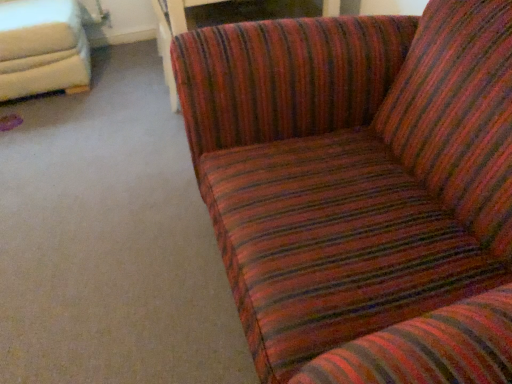
Where is `white leather studio couch at upper left, marked as the second studio couch in a right-to-left arrangement`? Image resolution: width=512 pixels, height=384 pixels. white leather studio couch at upper left, marked as the second studio couch in a right-to-left arrangement is located at coordinates (41, 48).

Where is `wooden table at center`? wooden table at center is located at coordinates (223, 21).

Find the location of a particular element. striped fabric couch at upper right, the second studio couch positioned from the left is located at coordinates (361, 189).

Which object is positioned more to the left, striped fabric couch at upper right, the second studio couch positioned from the left, or wooden table at center?

→ striped fabric couch at upper right, the second studio couch positioned from the left.

I want to click on table above the striped fabric couch at upper right, marked as the first studio couch in a right-to-left arrangement (from a real-world perspective), so click(223, 21).

Relative to wooden table at center, is striped fabric couch at upper right, the second studio couch positioned from the left, in front or behind?

Visually, striped fabric couch at upper right, the second studio couch positioned from the left, is located in front of wooden table at center.

From the image's perspective, who appears lower, striped fabric couch at upper right, the second studio couch positioned from the left, or wooden table at center?

striped fabric couch at upper right, the second studio couch positioned from the left, from the image's perspective.

Looking at this image, what's the angular difference between wooden table at center and striped fabric couch at upper right, the second studio couch positioned from the left,'s facing directions?

wooden table at center and striped fabric couch at upper right, the second studio couch positioned from the left, are facing 90.4 degrees away from each other.

Is point (173, 108) closer or farther from the camera than point (468, 80)?

Point (173, 108).

Who is shorter, wooden table at center or striped fabric couch at upper right, marked as the first studio couch in a right-to-left arrangement?

striped fabric couch at upper right, marked as the first studio couch in a right-to-left arrangement, is shorter.

This screenshot has width=512, height=384. I want to click on table behind the striped fabric couch at upper right, marked as the first studio couch in a right-to-left arrangement, so click(223, 21).

From the image's perspective, is striped fabric couch at upper right, marked as the first studio couch in a right-to-left arrangement, above white leather studio couch at upper left, marked as the second studio couch in a right-to-left arrangement?

No, from the image's perspective, striped fabric couch at upper right, marked as the first studio couch in a right-to-left arrangement, is not on top of white leather studio couch at upper left, marked as the second studio couch in a right-to-left arrangement.

Which of these two, striped fabric couch at upper right, marked as the first studio couch in a right-to-left arrangement, or white leather studio couch at upper left, marked as the second studio couch in a right-to-left arrangement, stands shorter?

striped fabric couch at upper right, marked as the first studio couch in a right-to-left arrangement.

Consider the image. Considering the positions of objects striped fabric couch at upper right, marked as the first studio couch in a right-to-left arrangement, and white leather studio couch at upper left, marked as the second studio couch in a right-to-left arrangement, in the image provided, who is more to the right, striped fabric couch at upper right, marked as the first studio couch in a right-to-left arrangement, or white leather studio couch at upper left, marked as the second studio couch in a right-to-left arrangement,?

striped fabric couch at upper right, marked as the first studio couch in a right-to-left arrangement, is more to the right.

Is wooden table at center smaller than white leather studio couch at upper left, the first studio couch viewed from the left?

Yes.

Based on the photo, is white leather studio couch at upper left, marked as the second studio couch in a right-to-left arrangement, at the back of wooden table at center?

No, wooden table at center is not facing the opposite direction of white leather studio couch at upper left, marked as the second studio couch in a right-to-left arrangement.

Are wooden table at center and white leather studio couch at upper left, the first studio couch viewed from the left, located far from each other?

They are positioned close to each other.

Is point (193, 15) behind point (12, 3)?

No, (193, 15) is in front of (12, 3).

Who is more distant, white leather studio couch at upper left, the first studio couch viewed from the left, or striped fabric couch at upper right, the second studio couch positioned from the left?

white leather studio couch at upper left, the first studio couch viewed from the left, is further from the camera.

Is white leather studio couch at upper left, the first studio couch viewed from the left, facing away from striped fabric couch at upper right, the second studio couch positioned from the left?

No, white leather studio couch at upper left, the first studio couch viewed from the left, is not facing away from striped fabric couch at upper right, the second studio couch positioned from the left.

Which of these two, white leather studio couch at upper left, marked as the second studio couch in a right-to-left arrangement, or striped fabric couch at upper right, the second studio couch positioned from the left, is wider?

With larger width is striped fabric couch at upper right, the second studio couch positioned from the left.

Between white leather studio couch at upper left, marked as the second studio couch in a right-to-left arrangement, and wooden table at center, which one appears on the left side from the viewer's perspective?

Positioned to the left is white leather studio couch at upper left, marked as the second studio couch in a right-to-left arrangement.

Which object is further away from the camera, white leather studio couch at upper left, the first studio couch viewed from the left, or wooden table at center?

white leather studio couch at upper left, the first studio couch viewed from the left.

Considering the relative sizes of white leather studio couch at upper left, the first studio couch viewed from the left, and wooden table at center in the image provided, is white leather studio couch at upper left, the first studio couch viewed from the left, smaller than wooden table at center?

Actually, white leather studio couch at upper left, the first studio couch viewed from the left, might be larger than wooden table at center.

What's the angular difference between white leather studio couch at upper left, marked as the second studio couch in a right-to-left arrangement, and wooden table at center's facing directions?

The facing directions of white leather studio couch at upper left, marked as the second studio couch in a right-to-left arrangement, and wooden table at center are 89.9 degrees apart.

Where is `table located above the striped fabric couch at upper right, marked as the first studio couch in a right-to-left arrangement (from the image's perspective)`? Image resolution: width=512 pixels, height=384 pixels. table located above the striped fabric couch at upper right, marked as the first studio couch in a right-to-left arrangement (from the image's perspective) is located at coordinates (223, 21).

Locate an element on the screen. studio couch lying in front of the wooden table at center is located at coordinates (361, 189).

In the scene shown: Estimate the real-world distances between objects in this image. Which object is closer to striped fabric couch at upper right, marked as the first studio couch in a right-to-left arrangement, wooden table at center or white leather studio couch at upper left, the first studio couch viewed from the left?

Among the two, wooden table at center is located nearer to striped fabric couch at upper right, marked as the first studio couch in a right-to-left arrangement.

When comparing their distances from white leather studio couch at upper left, marked as the second studio couch in a right-to-left arrangement, does wooden table at center or striped fabric couch at upper right, marked as the first studio couch in a right-to-left arrangement, seem closer?

wooden table at center is positioned closer to the anchor white leather studio couch at upper left, marked as the second studio couch in a right-to-left arrangement.

From the image, which object appears to be farther from white leather studio couch at upper left, the first studio couch viewed from the left, striped fabric couch at upper right, the second studio couch positioned from the left, or wooden table at center?

The object further to white leather studio couch at upper left, the first studio couch viewed from the left, is striped fabric couch at upper right, the second studio couch positioned from the left.

Consider the image. Which object lies nearer to the anchor point wooden table at center, white leather studio couch at upper left, marked as the second studio couch in a right-to-left arrangement, or striped fabric couch at upper right, marked as the first studio couch in a right-to-left arrangement?

striped fabric couch at upper right, marked as the first studio couch in a right-to-left arrangement, lies closer to wooden table at center than the other object.

Considering their positions, is striped fabric couch at upper right, marked as the first studio couch in a right-to-left arrangement, positioned closer to wooden table at center than white leather studio couch at upper left, the first studio couch viewed from the left?

striped fabric couch at upper right, marked as the first studio couch in a right-to-left arrangement, lies closer to wooden table at center than the other object.

From the image, which object appears to be nearer to striped fabric couch at upper right, marked as the first studio couch in a right-to-left arrangement, white leather studio couch at upper left, the first studio couch viewed from the left, or wooden table at center?

wooden table at center is closer to striped fabric couch at upper right, marked as the first studio couch in a right-to-left arrangement.

Locate an element on the screen. table between striped fabric couch at upper right, marked as the first studio couch in a right-to-left arrangement, and white leather studio couch at upper left, marked as the second studio couch in a right-to-left arrangement, along the z-axis is located at coordinates (223, 21).